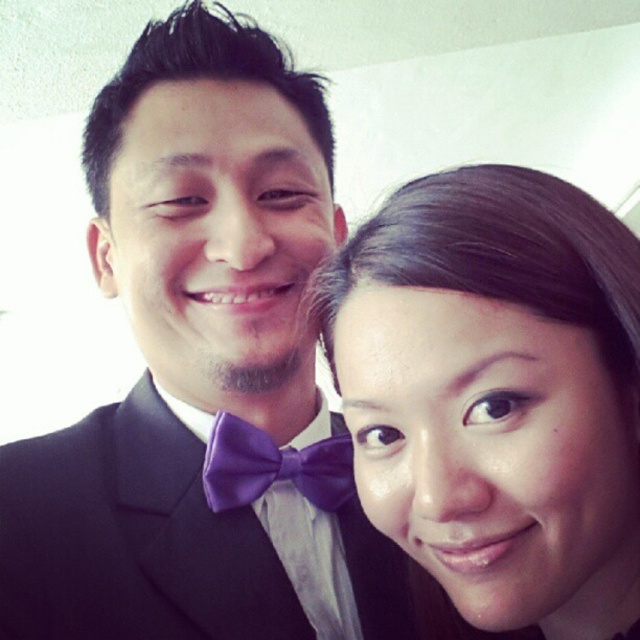
You are a photographer trying to focus on the smooth skin face at right and the matte black suit at center. Which object should you adjust your focus to first if you want to capture both clearly in the photo?

The smooth skin face at right is in front of the matte black suit at center, so you should focus on the smooth skin face at right first to ensure both are in focus.

Consider the image. You are taking a photo of two people standing in front of a white wall. The camera you are using has a focal length of 50mm and a sensor size of 24mm x 36mm. You want to ensure that the point at coordinates point (65, 484) is in focus. What is the minimum distance the camera should be from the two people to achieve this?

The point at coordinates point (65, 484) is 61.78 centimeters away from the camera. To ensure this point is in focus, the camera should be positioned at least 61.78 centimeters away from the two people.